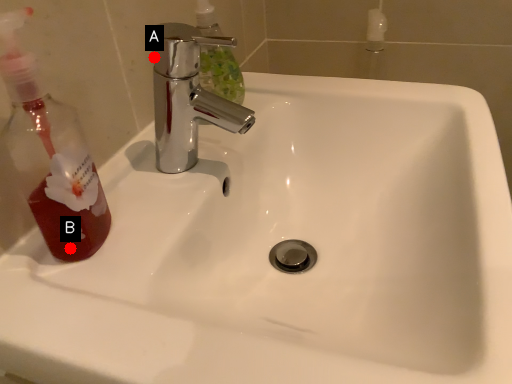
Question: Two points are circled on the image, labeled by A and B beside each circle. Which point is further to the camera?

Choices:
 (A) A is further
 (B) B is further

Answer: (A)